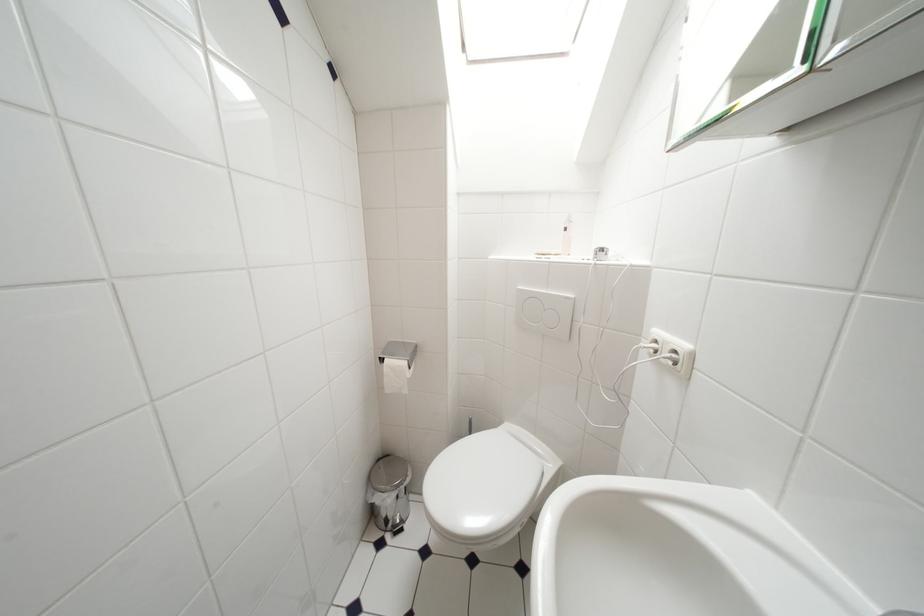
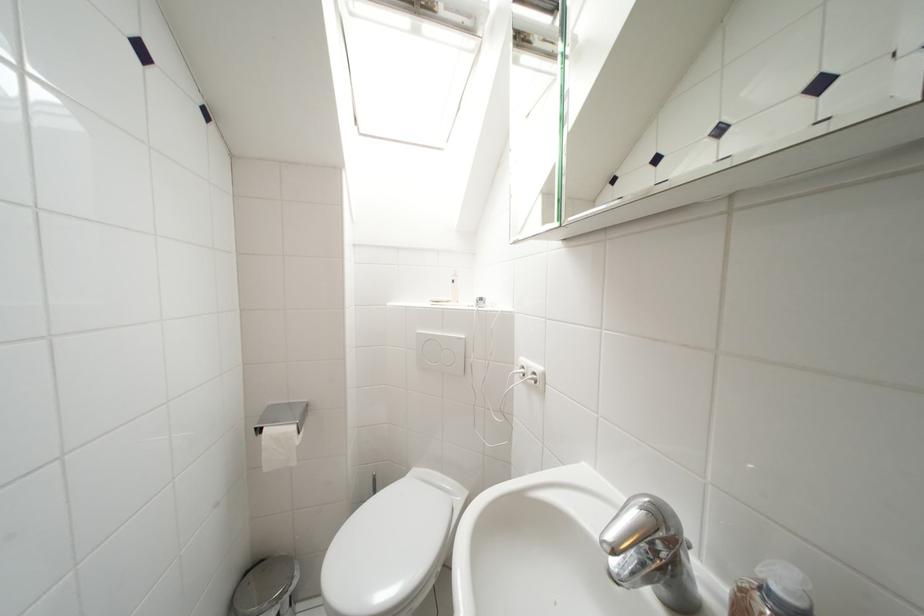
In the second image, find the point that corresponds to point 399,359 in the first image.

(283, 424)